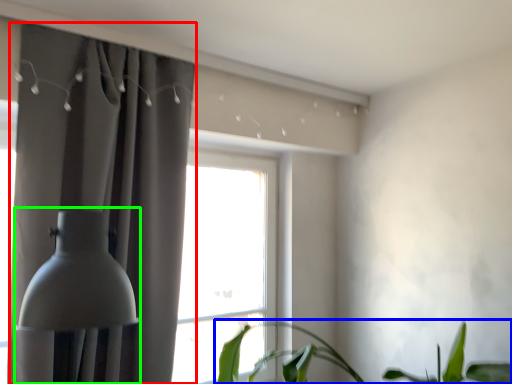
Question: Which is farther away from curtain (highlighted by a red box)? houseplant (highlighted by a blue box) or table lamp (highlighted by a green box)?

Choices:
 (A) houseplant
 (B) table lamp

Answer: (A)